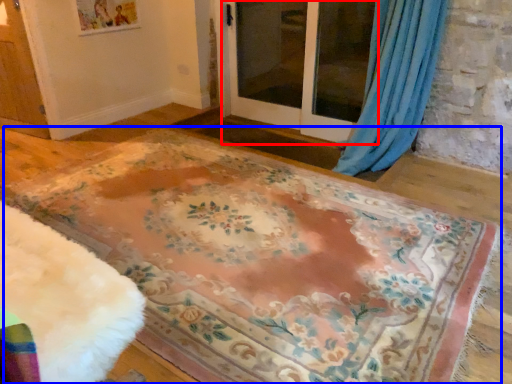
Question: Among these objects, which one is farthest to the camera, screen door (highlighted by a red box) or mat (highlighted by a blue box)?

Choices:
 (A) screen door
 (B) mat

Answer: (A)